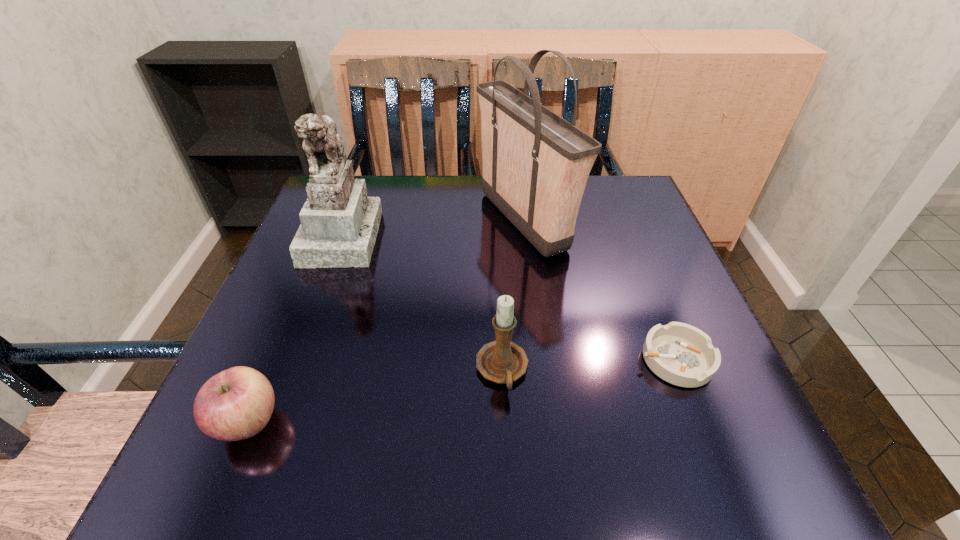
The image size is (960, 540). In the image, there is a desktop. Find the location of `free space at the near edge`. free space at the near edge is located at coordinates (352, 484).

The width and height of the screenshot is (960, 540). I want to click on vacant space at the left edge, so click(300, 284).

Locate an element on the screen. vacant space at the right edge is located at coordinates (671, 413).

I want to click on blank area at the far left corner, so click(x=373, y=197).

You are a GUI agent. You are given a task and a screenshot of the screen. Output one action in this format:
    pyautogui.click(x=<x>, y=<y>)
    Task: Click on the free space at the near left corner
    The width and height of the screenshot is (960, 540).
    Given the screenshot: What is the action you would take?
    pyautogui.click(x=296, y=448)

Image resolution: width=960 pixels, height=540 pixels. I want to click on free region at the far right corner of the desktop, so click(x=646, y=208).

Locate an element on the screen. The image size is (960, 540). free spot between the shortest object and the candle holder is located at coordinates (588, 365).

In order to click on free spot between the shopping bag and the apple in this screenshot , I will do `click(386, 321)`.

Where is `empty space that is in between the apple and the candle holder`? empty space that is in between the apple and the candle holder is located at coordinates (375, 396).

At what (x,y) coordinates should I click in order to perform the action: click on vacant area that lies between the fourth tallest object and the second tallest object. Please return your answer as a coordinate pair (x, y). Looking at the image, I should click on (296, 329).